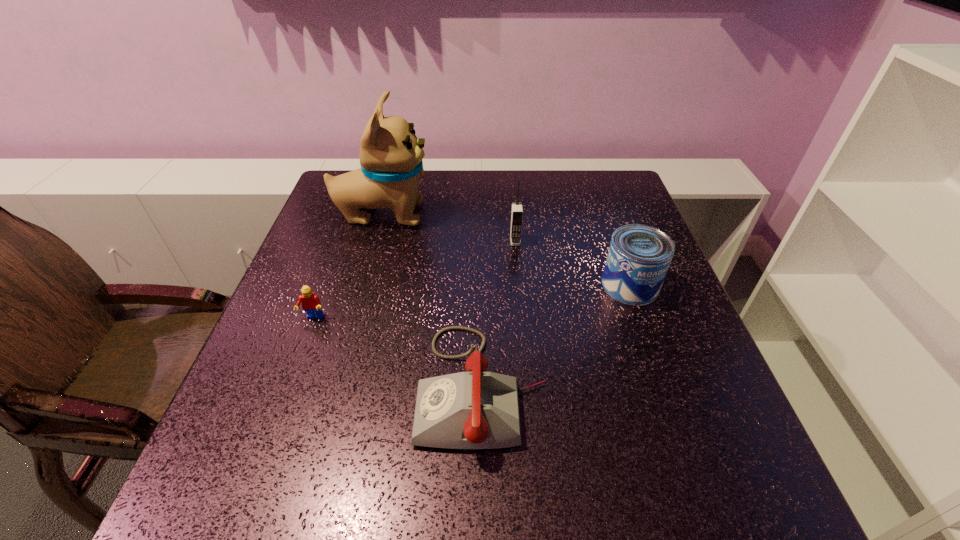
Where is `the farthest object`? the farthest object is located at coordinates (391, 156).

Locate an element on the screen. The width and height of the screenshot is (960, 540). the tallest object is located at coordinates (x=391, y=156).

Locate an element on the screen. the second tallest object is located at coordinates (517, 210).

Locate an element on the screen. the fourth nearest object is located at coordinates (517, 210).

The image size is (960, 540). I want to click on the rightmost object, so click(639, 256).

Image resolution: width=960 pixels, height=540 pixels. Find the location of `the third tallest object`. the third tallest object is located at coordinates (639, 256).

This screenshot has height=540, width=960. I want to click on the nearest object, so click(476, 409).

Identify the location of the fourth farthest object. (311, 304).

This screenshot has height=540, width=960. I want to click on vacant position located 0.200m on the face of the farthest object, so click(x=502, y=214).

Identify the location of vacant space located on the front-facing side of the cellular telephone. This screenshot has width=960, height=540. (517, 262).